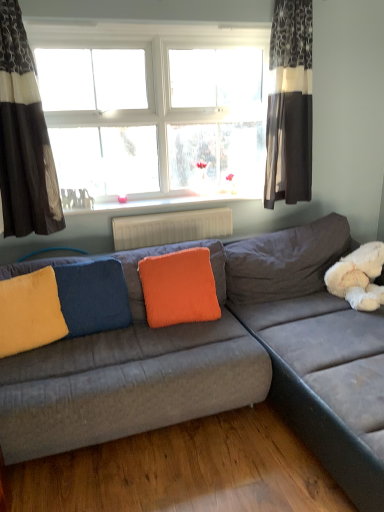
Question: Is white glossy radiator at upper center surrounding blue velvet pillow at center, the 2th pillow when ordered from right to left?

Choices:
 (A) no
 (B) yes

Answer: (A)

Question: Is the position of white glossy radiator at upper center more distant than that of blue velvet pillow at center, the 2th pillow when ordered from right to left?

Choices:
 (A) no
 (B) yes

Answer: (B)

Question: From the image's perspective, is white glossy radiator at upper center located above blue velvet pillow at center, marked as the second pillow in a left-to-right arrangement?

Choices:
 (A) yes
 (B) no

Answer: (A)

Question: From a real-world perspective, is white glossy radiator at upper center physically below blue velvet pillow at center, the 2th pillow when ordered from right to left?

Choices:
 (A) no
 (B) yes

Answer: (A)

Question: Is white glossy radiator at upper center outside of blue velvet pillow at center, the 2th pillow when ordered from right to left?

Choices:
 (A) no
 (B) yes

Answer: (B)

Question: Is white glossy radiator at upper center far from blue velvet pillow at center, the 2th pillow when ordered from right to left?

Choices:
 (A) no
 (B) yes

Answer: (A)

Question: From the image's perspective, does velvet gray couch at center appear higher than blue velvet pillow at center, marked as the second pillow in a left-to-right arrangement?

Choices:
 (A) yes
 (B) no

Answer: (B)

Question: Can you confirm if velvet gray couch at center is bigger than blue velvet pillow at center, the 2th pillow when ordered from right to left?

Choices:
 (A) yes
 (B) no

Answer: (A)

Question: Is velvet gray couch at center positioned beyond the bounds of blue velvet pillow at center, the 2th pillow when ordered from right to left?

Choices:
 (A) no
 (B) yes

Answer: (B)

Question: Considering the relative positions of velvet gray couch at center and blue velvet pillow at center, the 2th pillow when ordered from right to left, in the image provided, is velvet gray couch at center behind blue velvet pillow at center, the 2th pillow when ordered from right to left,?

Choices:
 (A) no
 (B) yes

Answer: (A)

Question: From the image's perspective, is velvet gray couch at center beneath blue velvet pillow at center, the 2th pillow when ordered from right to left?

Choices:
 (A) yes
 (B) no

Answer: (A)

Question: Are velvet gray couch at center and blue velvet pillow at center, the 2th pillow when ordered from right to left, far apart?

Choices:
 (A) yes
 (B) no

Answer: (B)

Question: Considering the relative sizes of dark gray textured curtain at left, the second curtain when ordered from right to left, and white glossy radiator at upper center in the image provided, is dark gray textured curtain at left, the second curtain when ordered from right to left, wider than white glossy radiator at upper center?

Choices:
 (A) yes
 (B) no

Answer: (B)